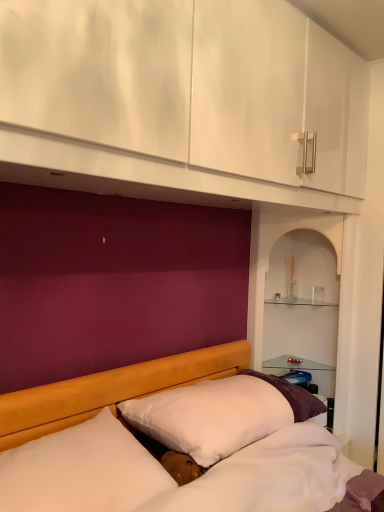
Where is `white soft pillow at center, the second pillow in the front-to-back sequence`? This screenshot has height=512, width=384. white soft pillow at center, the second pillow in the front-to-back sequence is located at coordinates (221, 414).

This screenshot has height=512, width=384. In order to click on white soft pillow at center, the 1th pillow when ordered from back to front in this screenshot , I will do `click(221, 414)`.

You are a GUI agent. You are given a task and a screenshot of the screen. Output one action in this format:
    pyautogui.click(x=<x>, y=<y>)
    Task: Click on the shelf behind the clear glass shelves at right, which ranks as the 2th shelf in top-to-bottom order
    The image size is (384, 512).
    Given the screenshot: What is the action you would take?
    pyautogui.click(x=297, y=301)

Which object is wider, clear glass shelves at right, which ranks as the 2th shelf in top-to-bottom order, or clear glass shelf at upper center, the 2th shelf when ordered from bottom to top?

Wider between the two is clear glass shelves at right, which ranks as the 2th shelf in top-to-bottom order.

Does clear glass shelves at right, arranged as the 1th shelf when ordered from the bottom, have a smaller size compared to clear glass shelf at upper center, placed as the 1th shelf when sorted from top to bottom?

No, clear glass shelves at right, arranged as the 1th shelf when ordered from the bottom, is not smaller than clear glass shelf at upper center, placed as the 1th shelf when sorted from top to bottom.

Find the location of a particular element. Image resolution: width=384 pixels, height=512 pixels. the 1st shelf above the white soft pillow at lower left, positioned as the 2th pillow in back-to-front order (from the image's perspective) is located at coordinates (269, 255).

From a real-world perspective, who is located higher, white soft pillow at lower left, the first pillow from the front, or clear glass shelves at right, arranged as the 1th shelf when ordered from the bottom?

clear glass shelves at right, arranged as the 1th shelf when ordered from the bottom, from a real-world perspective.

Is white soft pillow at lower left, positioned as the 2th pillow in back-to-front order, looking in the opposite direction of clear glass shelves at right, arranged as the 1th shelf when ordered from the bottom?

white soft pillow at lower left, positioned as the 2th pillow in back-to-front order, is not turned away from clear glass shelves at right, arranged as the 1th shelf when ordered from the bottom.

Does white soft pillow at lower left, the first pillow from the front, have a lesser width compared to clear glass shelves at right, which ranks as the 2th shelf in top-to-bottom order?

No, white soft pillow at lower left, the first pillow from the front, is not thinner than clear glass shelves at right, which ranks as the 2th shelf in top-to-bottom order.

Considering the positions of objects clear glass shelves at right, which ranks as the 2th shelf in top-to-bottom order, and white soft pillow at center, the 1th pillow when ordered from back to front, in the image provided, who is in front, clear glass shelves at right, which ranks as the 2th shelf in top-to-bottom order, or white soft pillow at center, the 1th pillow when ordered from back to front,?

white soft pillow at center, the 1th pillow when ordered from back to front, is more forward.

Can you confirm if clear glass shelves at right, which ranks as the 2th shelf in top-to-bottom order, is thinner than white soft pillow at center, the second pillow in the front-to-back sequence?

Yes.

Between point (257, 220) and point (197, 440), which one is positioned in front?

Point (197, 440)

Which shelf is the 2nd one when counting from the back of the white soft pillow at lower left, positioned as the 2th pillow in back-to-front order? Please provide its 2D coordinates.

[(297, 301)]

From a real-world perspective, is white soft pillow at lower left, positioned as the 2th pillow in back-to-front order, positioned over clear glass shelf at upper center, placed as the 1th shelf when sorted from top to bottom, based on gravity?

No, from a real-world perspective, white soft pillow at lower left, positioned as the 2th pillow in back-to-front order, is not over clear glass shelf at upper center, placed as the 1th shelf when sorted from top to bottom

Is white soft pillow at lower left, the first pillow from the front, situated inside clear glass shelf at upper center, the 2th shelf when ordered from bottom to top, or outside?

white soft pillow at lower left, the first pillow from the front, exists outside the volume of clear glass shelf at upper center, the 2th shelf when ordered from bottom to top.

How far apart are white soft pillow at lower left, the first pillow from the front, and clear glass shelf at upper center, the 2th shelf when ordered from bottom to top?

white soft pillow at lower left, the first pillow from the front, and clear glass shelf at upper center, the 2th shelf when ordered from bottom to top, are 1.47 meters apart from each other.

From the picture: From a real-world perspective, is white soft pillow at center, the 1th pillow when ordered from back to front, on top of clear glass shelf at upper center, placed as the 1th shelf when sorted from top to bottom?

No, from a real-world perspective, white soft pillow at center, the 1th pillow when ordered from back to front, is not on top of clear glass shelf at upper center, placed as the 1th shelf when sorted from top to bottom.

What are the coordinates of `the 1st pillow positioned below the clear glass shelf at upper center, the 2th shelf when ordered from bottom to top (from the image's perspective)` in the screenshot? It's located at pyautogui.click(x=221, y=414).

Considering the sizes of objects white soft pillow at center, the second pillow in the front-to-back sequence, and clear glass shelf at upper center, the 2th shelf when ordered from bottom to top, in the image provided, who is bigger, white soft pillow at center, the second pillow in the front-to-back sequence, or clear glass shelf at upper center, the 2th shelf when ordered from bottom to top,?

Bigger between the two is white soft pillow at center, the second pillow in the front-to-back sequence.

Choose the correct answer: Is white soft pillow at center, the second pillow in the front-to-back sequence, inside clear glass shelf at upper center, placed as the 1th shelf when sorted from top to bottom, or outside it?

white soft pillow at center, the second pillow in the front-to-back sequence, is not inside clear glass shelf at upper center, placed as the 1th shelf when sorted from top to bottom, it's outside.

From a real-world perspective, does clear glass shelf at upper center, the 2th shelf when ordered from bottom to top, stand above clear glass shelves at right, arranged as the 1th shelf when ordered from the bottom?

Yes.

From the picture: Does clear glass shelf at upper center, the 2th shelf when ordered from bottom to top, have a greater height compared to clear glass shelves at right, arranged as the 1th shelf when ordered from the bottom?

No, clear glass shelf at upper center, the 2th shelf when ordered from bottom to top, is not taller than clear glass shelves at right, arranged as the 1th shelf when ordered from the bottom.

From the image's perspective, would you say clear glass shelf at upper center, the 2th shelf when ordered from bottom to top, is positioned over clear glass shelves at right, arranged as the 1th shelf when ordered from the bottom?

Correct, clear glass shelf at upper center, the 2th shelf when ordered from bottom to top, appears higher than clear glass shelves at right, arranged as the 1th shelf when ordered from the bottom, in the image.

Does clear glass shelf at upper center, the 2th shelf when ordered from bottom to top, have a greater width compared to clear glass shelves at right, which ranks as the 2th shelf in top-to-bottom order?

Incorrect, the width of clear glass shelf at upper center, the 2th shelf when ordered from bottom to top, does not surpass that of clear glass shelves at right, which ranks as the 2th shelf in top-to-bottom order.

Is white soft pillow at lower left, positioned as the 2th pillow in back-to-front order, far from white soft pillow at center, the 1th pillow when ordered from back to front?

No, there isn't a large distance between white soft pillow at lower left, positioned as the 2th pillow in back-to-front order, and white soft pillow at center, the 1th pillow when ordered from back to front.

In the image, is white soft pillow at lower left, positioned as the 2th pillow in back-to-front order, on the left side or the right side of white soft pillow at center, the second pillow in the front-to-back sequence?

From the image, it's evident that white soft pillow at lower left, positioned as the 2th pillow in back-to-front order, is to the left of white soft pillow at center, the second pillow in the front-to-back sequence.

This screenshot has height=512, width=384. Identify the location of pillow on the left of white soft pillow at center, the second pillow in the front-to-back sequence. (82, 470).

This screenshot has height=512, width=384. I want to click on shelf below the clear glass shelf at upper center, the 2th shelf when ordered from bottom to top (from a real-world perspective), so click(x=269, y=255).

At what (x,y) coordinates should I click in order to perform the action: click on pillow that is the 2nd one when counting forward from the clear glass shelves at right, which ranks as the 2th shelf in top-to-bottom order. Please return your answer as a coordinate pair (x, y). Looking at the image, I should click on (82, 470).

From the image, which object appears to be farther from white soft pillow at lower left, the first pillow from the front, clear glass shelf at upper center, placed as the 1th shelf when sorted from top to bottom, or white soft pillow at center, the 1th pillow when ordered from back to front?

Based on the image, clear glass shelf at upper center, placed as the 1th shelf when sorted from top to bottom, appears to be further to white soft pillow at lower left, the first pillow from the front.

Which object lies further to the anchor point clear glass shelves at right, which ranks as the 2th shelf in top-to-bottom order, clear glass shelf at upper center, placed as the 1th shelf when sorted from top to bottom, or white soft pillow at lower left, positioned as the 2th pillow in back-to-front order?

white soft pillow at lower left, positioned as the 2th pillow in back-to-front order, is further to clear glass shelves at right, which ranks as the 2th shelf in top-to-bottom order.

Considering their positions, is clear glass shelves at right, which ranks as the 2th shelf in top-to-bottom order, positioned closer to white soft pillow at lower left, positioned as the 2th pillow in back-to-front order, than white soft pillow at center, the second pillow in the front-to-back sequence?

white soft pillow at center, the second pillow in the front-to-back sequence, is positioned closer to the anchor white soft pillow at lower left, positioned as the 2th pillow in back-to-front order.

Looking at the image, which one is located further to white soft pillow at center, the second pillow in the front-to-back sequence, white soft pillow at lower left, positioned as the 2th pillow in back-to-front order, or clear glass shelf at upper center, the 2th shelf when ordered from bottom to top?

clear glass shelf at upper center, the 2th shelf when ordered from bottom to top.

Looking at this image, when comparing their distances from clear glass shelves at right, arranged as the 1th shelf when ordered from the bottom, does white soft pillow at lower left, the first pillow from the front, or clear glass shelf at upper center, the 2th shelf when ordered from bottom to top, seem further?

The object further to clear glass shelves at right, arranged as the 1th shelf when ordered from the bottom, is white soft pillow at lower left, the first pillow from the front.

Estimate the real-world distances between objects in this image. Which object is closer to clear glass shelf at upper center, placed as the 1th shelf when sorted from top to bottom, white soft pillow at center, the 1th pillow when ordered from back to front, or white soft pillow at lower left, positioned as the 2th pillow in back-to-front order?

white soft pillow at center, the 1th pillow when ordered from back to front, is positioned closer to the anchor clear glass shelf at upper center, placed as the 1th shelf when sorted from top to bottom.

Looking at the image, which one is located closer to clear glass shelf at upper center, the 2th shelf when ordered from bottom to top, clear glass shelves at right, which ranks as the 2th shelf in top-to-bottom order, or white soft pillow at center, the second pillow in the front-to-back sequence?

clear glass shelves at right, which ranks as the 2th shelf in top-to-bottom order, is positioned closer to the anchor clear glass shelf at upper center, the 2th shelf when ordered from bottom to top.

Based on their spatial positions, is white soft pillow at lower left, the first pillow from the front, or clear glass shelves at right, which ranks as the 2th shelf in top-to-bottom order, closer to white soft pillow at center, the 1th pillow when ordered from back to front?

Based on the image, white soft pillow at lower left, the first pillow from the front, appears to be nearer to white soft pillow at center, the 1th pillow when ordered from back to front.

This screenshot has width=384, height=512. I want to click on pillow between white soft pillow at lower left, the first pillow from the front, and clear glass shelf at upper center, placed as the 1th shelf when sorted from top to bottom, from front to back, so click(221, 414).

Identify the location of shelf between white soft pillow at center, the second pillow in the front-to-back sequence, and clear glass shelf at upper center, placed as the 1th shelf when sorted from top to bottom, from front to back. pyautogui.click(x=269, y=255).

This screenshot has height=512, width=384. Identify the location of pillow between white soft pillow at lower left, the first pillow from the front, and clear glass shelves at right, which ranks as the 2th shelf in top-to-bottom order, in the front-back direction. (221, 414).

At what (x,y) coordinates should I click in order to perform the action: click on shelf positioned between white soft pillow at lower left, positioned as the 2th pillow in back-to-front order, and clear glass shelf at upper center, the 2th shelf when ordered from bottom to top, from near to far. Please return your answer as a coordinate pair (x, y). Image resolution: width=384 pixels, height=512 pixels. Looking at the image, I should click on (269, 255).